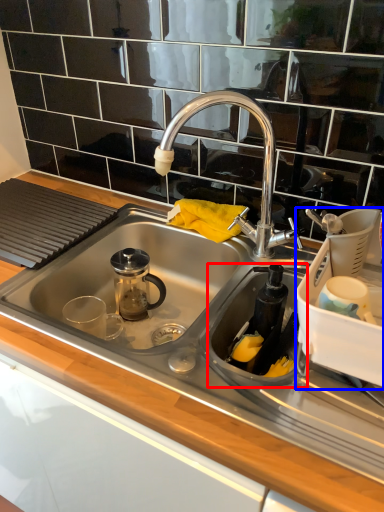
Question: Which point is closer to the camera, appliance (highlighted by a red box) or appliance (highlighted by a blue box)?

Choices:
 (A) appliance
 (B) appliance

Answer: (B)